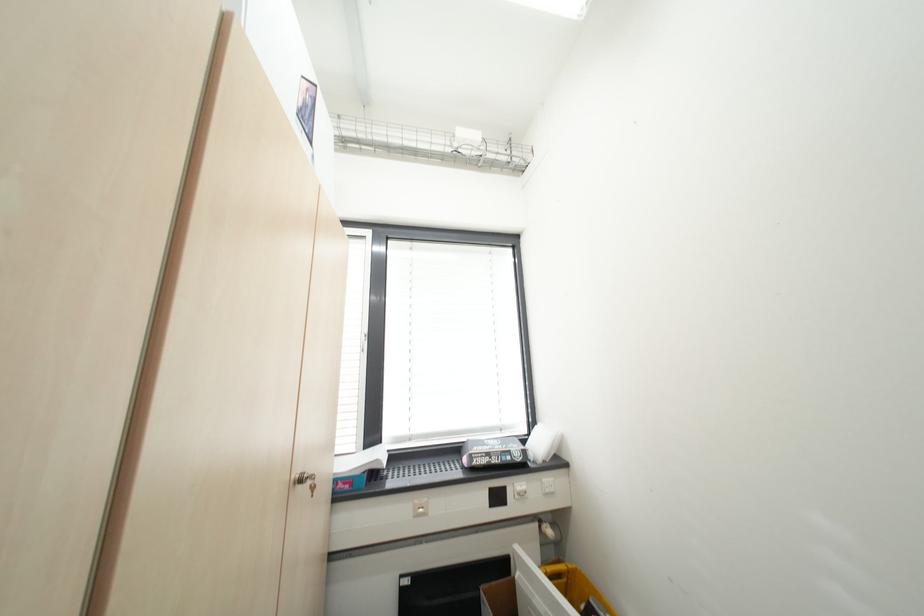
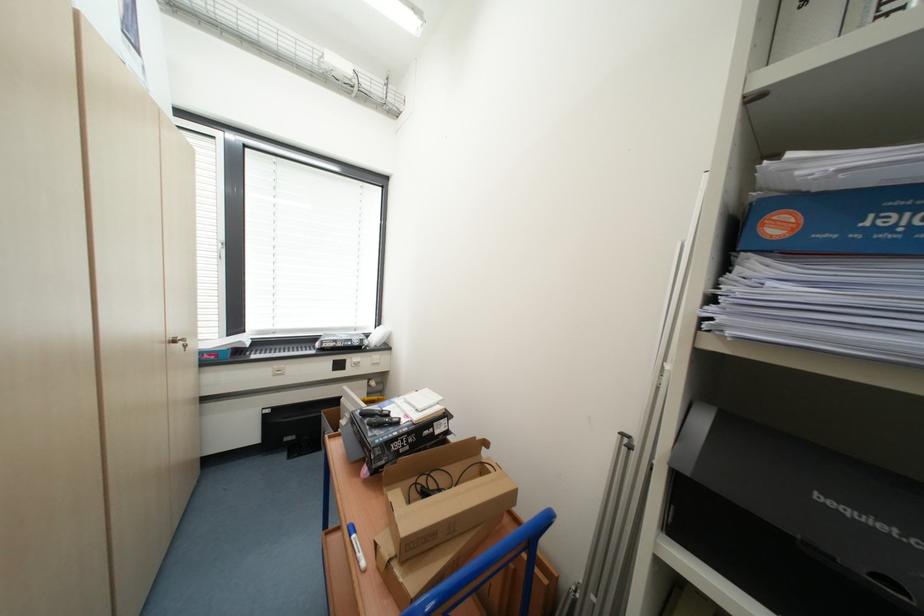
The images are taken continuously from a first-person perspective. In which direction are you moving?

The cameraman walked toward right, backward.